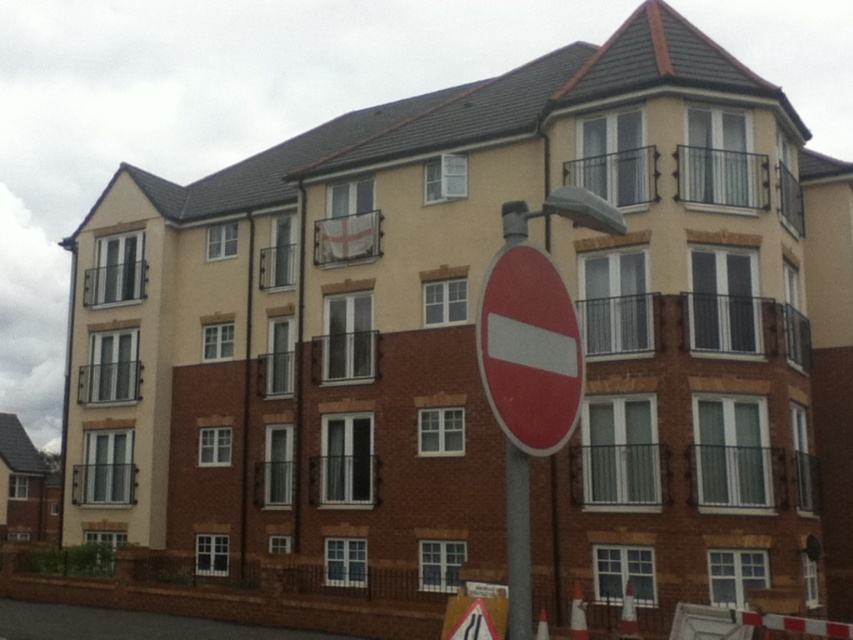
Question: Which object is closer to the camera taking this photo?

Choices:
 (A) metallic gray pole at center
 (B) red matte sign at center

Answer: (B)

Question: Which point is closer to the camera?

Choices:
 (A) metallic gray pole at center
 (B) red matte sign at center

Answer: (B)

Question: Is red matte sign at center smaller than metallic gray pole at center?

Choices:
 (A) no
 (B) yes

Answer: (B)

Question: Which of the following is the closest to the observer?

Choices:
 (A) metallic gray pole at center
 (B) red matte sign at center

Answer: (B)

Question: Is red matte sign at center positioned behind metallic gray pole at center?

Choices:
 (A) no
 (B) yes

Answer: (A)

Question: Does red matte sign at center have a smaller size compared to metallic gray pole at center?

Choices:
 (A) no
 (B) yes

Answer: (B)